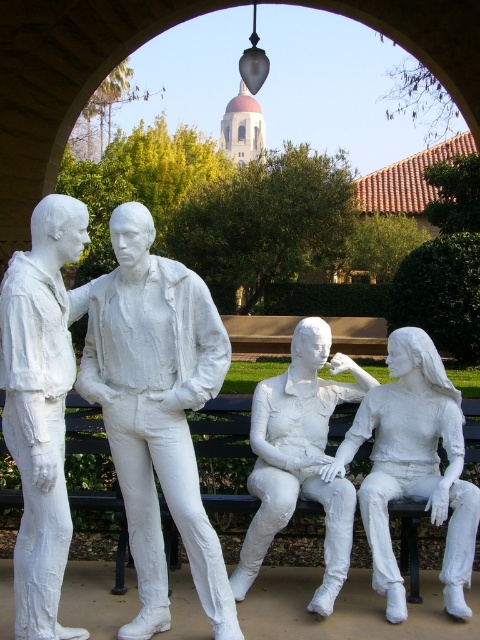
Which is more to the left, white plaster statue at left or white plaster figure at left?

white plaster figure at left

Can you confirm if white plaster statue at left is smaller than white plaster figure at left?

No.

Which is behind, point (127, 412) or point (2, 346)?

The point (127, 412) is behind.

At what (x,y) coordinates should I click in order to perform the action: click on white plaster statue at left. Please return your answer as a coordinate pair (x, y). This screenshot has height=640, width=480. Looking at the image, I should click on (156, 412).

Does white plaster figure at center have a greater width compared to black painted wood bench at center?

Yes.

Does point (346, 483) come in front of point (91, 422)?

Yes, it is in front of point (91, 422).

Which is in front, point (308, 337) or point (342, 412)?

Positioned in front is point (308, 337).

Identify the location of white plaster figure at center. The height and width of the screenshot is (640, 480). (300, 458).

Does white matte statue at center come in front of white plaster figure at center?

That is True.

Does white matte statue at center appear on the left side of white plaster figure at center?

In fact, white matte statue at center is to the right of white plaster figure at center.

Is point (350, 442) positioned in front of point (310, 490)?

No, (350, 442) is behind (310, 490).

Identify the location of white matte statue at center. (414, 467).